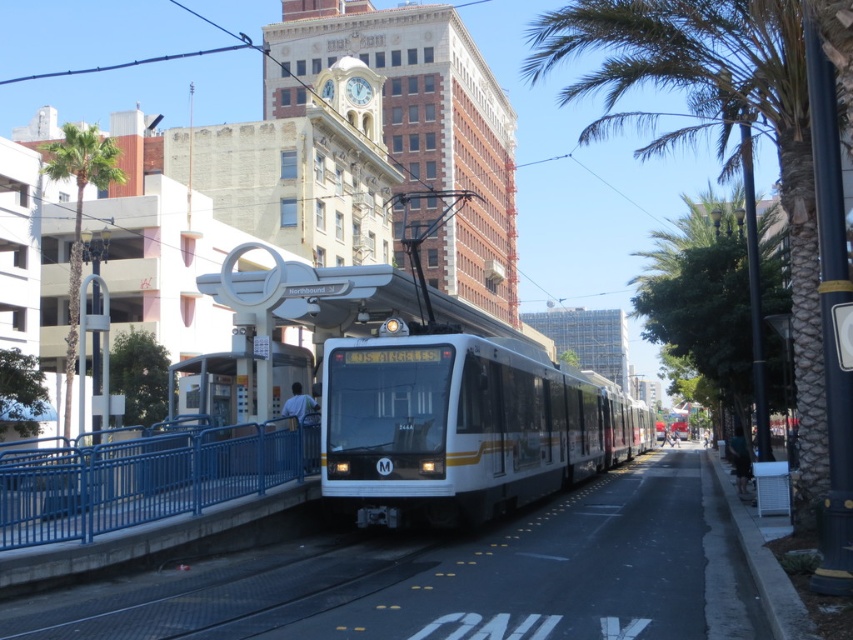
Does white glossy train at center have a greater height compared to blue metal railing at lower left?

Yes.

Based on the photo, is the position of white glossy train at center less distant than that of blue metal railing at lower left?

That is False.

Who is more forward, (393, 524) or (172, 504)?

Point (172, 504)

Locate an element on the screen. This screenshot has height=640, width=853. white glossy train at center is located at coordinates (461, 426).

Which is behind, point (90, 518) or point (70, 147)?

Point (70, 147)

Is the position of blue metal railing at lower left less distant than that of green leafy palm tree at left?

Yes.

Which is in front, point (138, 477) or point (74, 342)?

Point (138, 477) is in front.

Where is `blue metal railing at lower left`? blue metal railing at lower left is located at coordinates (144, 477).

Does white glossy train at center have a greater height compared to green leafy palm tree at left?

In fact, white glossy train at center may be shorter than green leafy palm tree at left.

Can you confirm if white glossy train at center is wider than green leafy palm tree at left?

Incorrect, white glossy train at center's width does not surpass green leafy palm tree at left's.

Is point (343, 397) positioned behind point (77, 253)?

No, (343, 397) is in front of (77, 253).

Image resolution: width=853 pixels, height=640 pixels. I want to click on white glossy train at center, so click(x=461, y=426).